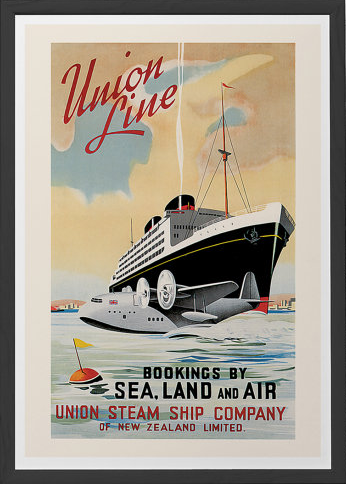
The width and height of the screenshot is (346, 484). Find the location of `cables`. cables is located at coordinates (208, 158), (215, 167).